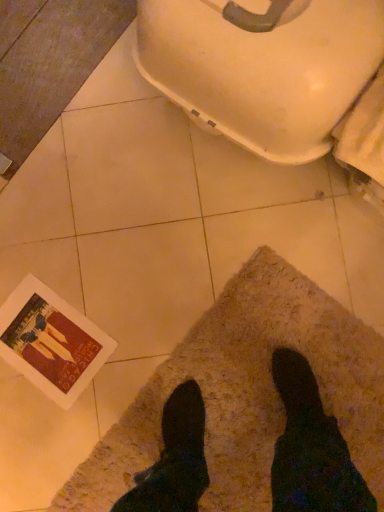
The height and width of the screenshot is (512, 384). Find the location of `free area behind beige shaggy mat at lower center`. free area behind beige shaggy mat at lower center is located at coordinates (118, 258).